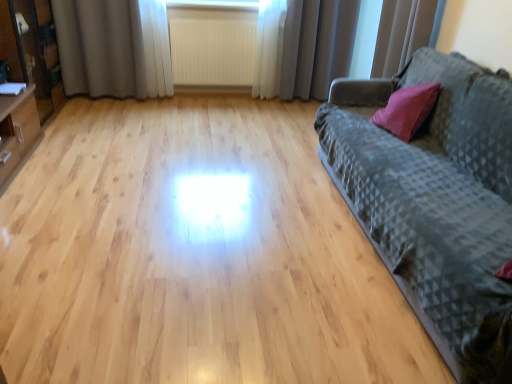
Question: From the image's perspective, does white sheer curtain at upper right, which ranks as the 1th curtain in right-to-left order, appear lower than white textured radiator at center?

Choices:
 (A) yes
 (B) no

Answer: (A)

Question: Can you confirm if white sheer curtain at upper right, which is counted as the third curtain, starting from the left, is wider than white textured radiator at center?

Choices:
 (A) yes
 (B) no

Answer: (A)

Question: Is white sheer curtain at upper right, which ranks as the 1th curtain in right-to-left order, next to white textured radiator at center?

Choices:
 (A) yes
 (B) no

Answer: (B)

Question: Is white sheer curtain at upper right, which ranks as the 1th curtain in right-to-left order, smaller than white textured radiator at center?

Choices:
 (A) no
 (B) yes

Answer: (A)

Question: Is white sheer curtain at upper right, which ranks as the 1th curtain in right-to-left order, outside white textured radiator at center?

Choices:
 (A) no
 (B) yes

Answer: (B)

Question: Is white sheer curtain at upper right, which is counted as the third curtain, starting from the left, positioned with its back to white textured radiator at center?

Choices:
 (A) no
 (B) yes

Answer: (A)

Question: Does dark gray textured fabric couch at right appear on the right side of gray fabric curtain at upper center, the 2th curtain positioned from the left?

Choices:
 (A) no
 (B) yes

Answer: (B)

Question: Is dark gray textured fabric couch at right thinner than gray fabric curtain at upper center, which ranks as the second curtain in right-to-left order?

Choices:
 (A) no
 (B) yes

Answer: (A)

Question: Is dark gray textured fabric couch at right at the left side of gray fabric curtain at upper center, which ranks as the second curtain in right-to-left order?

Choices:
 (A) no
 (B) yes

Answer: (A)

Question: Is dark gray textured fabric couch at right looking in the opposite direction of gray fabric curtain at upper center, the 2th curtain positioned from the left?

Choices:
 (A) no
 (B) yes

Answer: (A)

Question: From a real-world perspective, is dark gray textured fabric couch at right beneath gray fabric curtain at upper center, which ranks as the second curtain in right-to-left order?

Choices:
 (A) yes
 (B) no

Answer: (A)

Question: Is gray fabric curtain at upper center, the 2th curtain positioned from the left, located within dark gray textured fabric couch at right?

Choices:
 (A) no
 (B) yes

Answer: (A)

Question: Would you consider white textured radiator at center to be distant from matte black cabinet at left?

Choices:
 (A) yes
 (B) no

Answer: (A)